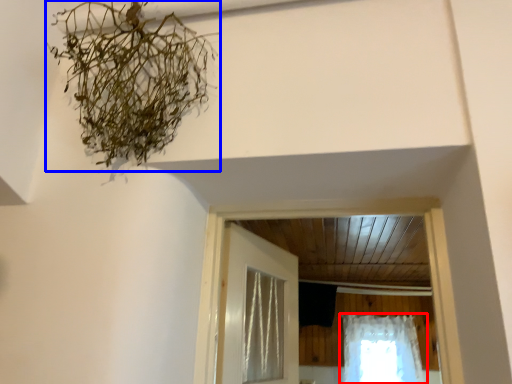
Question: Among these objects, which one is farthest to the camera, curtain (highlighted by a red box) or plant (highlighted by a blue box)?

Choices:
 (A) curtain
 (B) plant

Answer: (A)